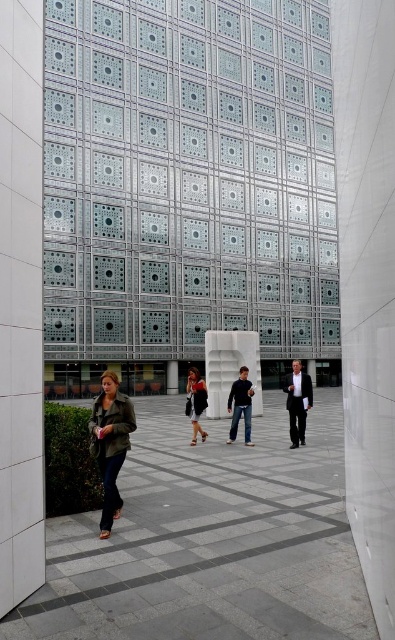
Describe the element at coordinates (231, 368) in the screenshot. I see `white marble pillar at center` at that location.

Between white marble pillar at center and black leather jacket at center, which one has less height?

white marble pillar at center is shorter.

Is point (233, 368) positioned before point (193, 400)?

No, (233, 368) is behind (193, 400).

Locate an element on the screen. The width and height of the screenshot is (395, 640). white marble pillar at center is located at coordinates (231, 368).

Is point (122, 445) more distant than point (255, 410)?

No, (122, 445) is closer to viewer.

Which is more to the left, green matte jacket at lower left or white marble pillar at center?

From the viewer's perspective, green matte jacket at lower left appears more on the left side.

The height and width of the screenshot is (640, 395). Describe the element at coordinates (110, 444) in the screenshot. I see `green matte jacket at lower left` at that location.

Where is `green matte jacket at lower left`? green matte jacket at lower left is located at coordinates (110, 444).

Can you confirm if dark gray suit at center is bigger than black leather jacket at center?

Yes.

Can you confirm if dark gray suit at center is positioned above black leather jacket at center?

No, dark gray suit at center is not above black leather jacket at center.

Who is more forward, (x=285, y=380) or (x=195, y=387)?

Positioned in front is point (x=195, y=387).

Identify the location of dark gray suit at center. Image resolution: width=395 pixels, height=640 pixels. (297, 401).